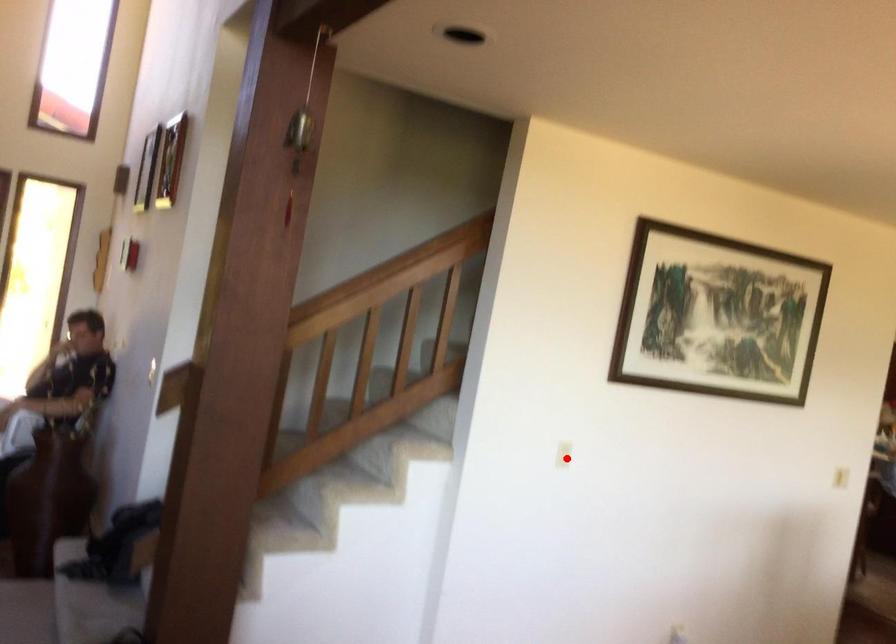
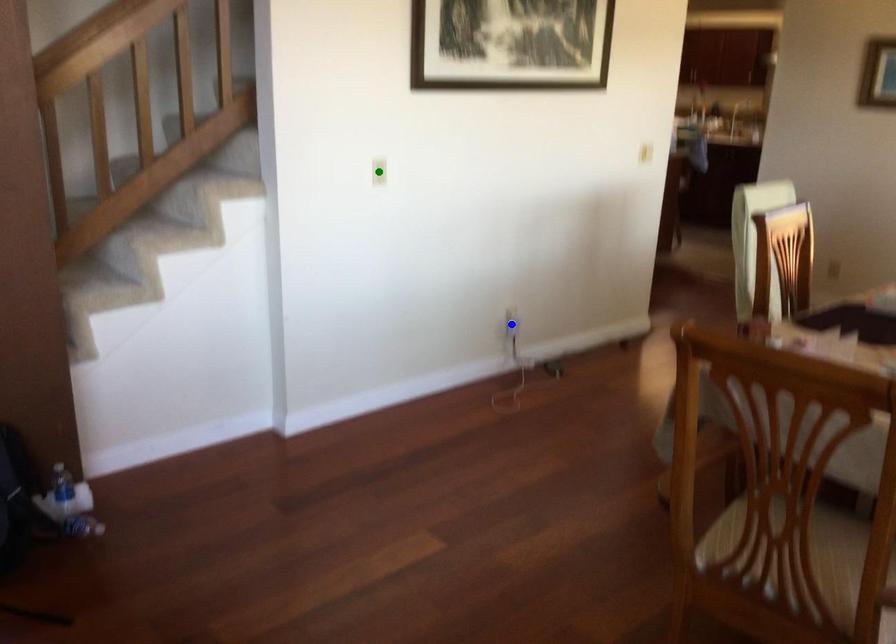
Question: I am providing you with two images of the same scene from different viewpoints. A red point is marked on the first image. You are given multiple points on the second image. In image 2, which mark is for the same physical point as the one in image 1?

Choices:
 (A) yellow point
 (B) blue point
 (C) green point

Answer: (C)